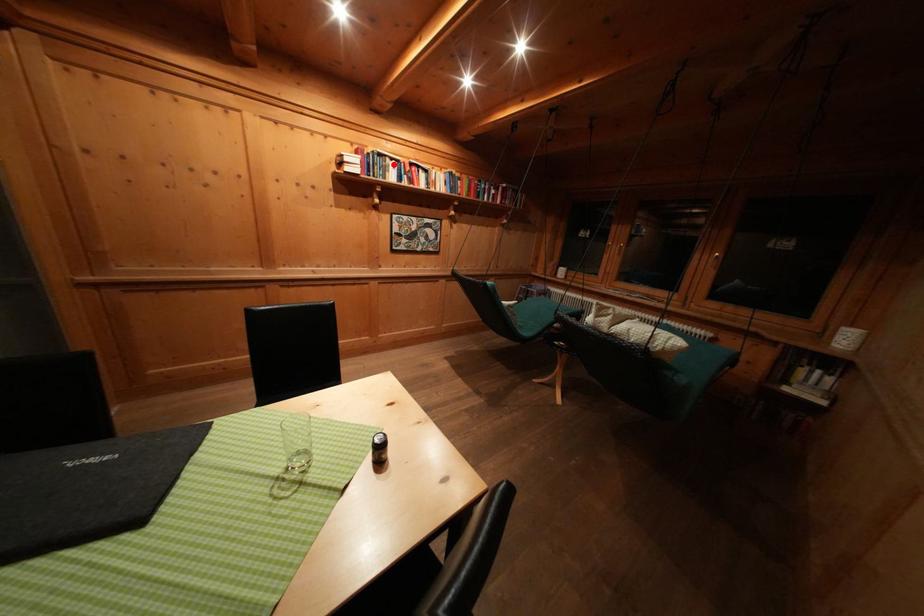
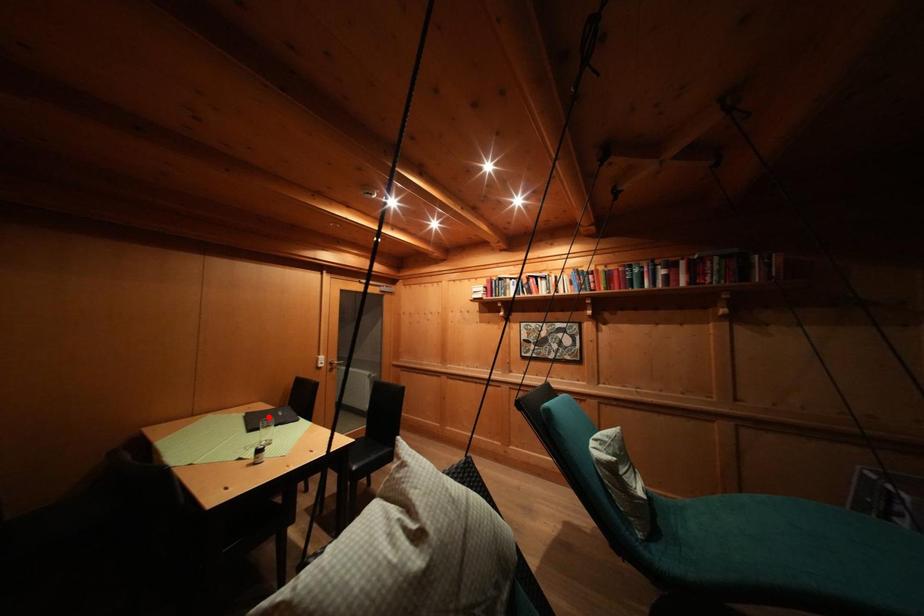
I am providing you with two images of the same scene from different viewpoints. A red point is marked on the first image and another point is marked on the second image. Does the point marked in image1 correspond to the same location as the one in image2?

No